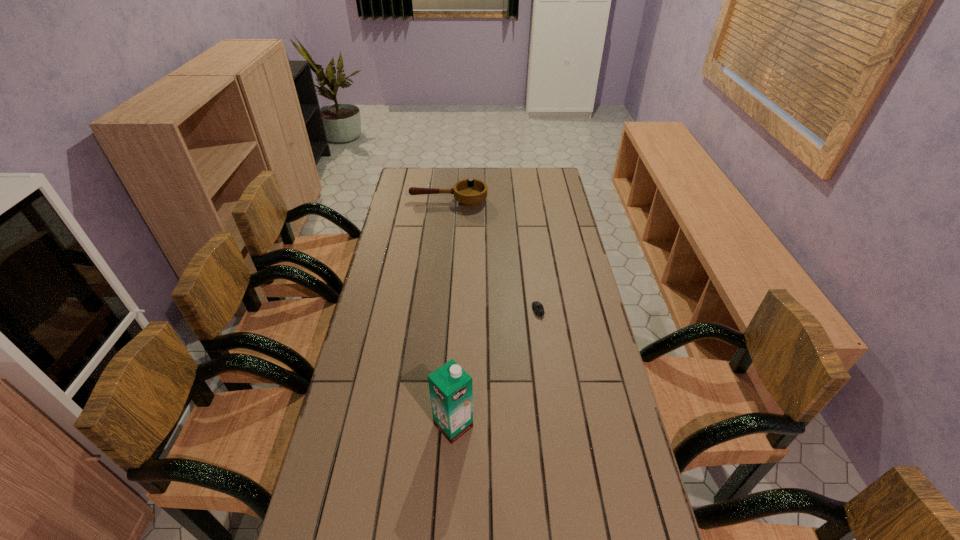
I want to click on the nearest object, so (x=451, y=388).

The height and width of the screenshot is (540, 960). In order to click on carton in this screenshot , I will do [x=451, y=388].

Image resolution: width=960 pixels, height=540 pixels. In order to click on the farthest object in this screenshot , I will do `click(469, 193)`.

Identify the location of the second shortest object. This screenshot has width=960, height=540. (469, 193).

What are the coordinates of `the rightmost object` in the screenshot? It's located at (538, 308).

I want to click on the shortest object, so click(538, 308).

You are a GUI agent. You are given a task and a screenshot of the screen. Output one action in this format:
    pyautogui.click(x=<x>, y=<y>)
    Task: Click on the free space located on the left of the tallest object
    
    Given the screenshot: What is the action you would take?
    pyautogui.click(x=393, y=425)

At what (x,y) coordinates should I click in order to perform the action: click on blank space located on the left of the shortest object. Please return your answer as a coordinate pair (x, y). Looking at the image, I should click on (465, 312).

Image resolution: width=960 pixels, height=540 pixels. Identify the location of object that is at the far edge. (469, 193).

What are the coordinates of `object present at the left edge` in the screenshot? It's located at (469, 193).